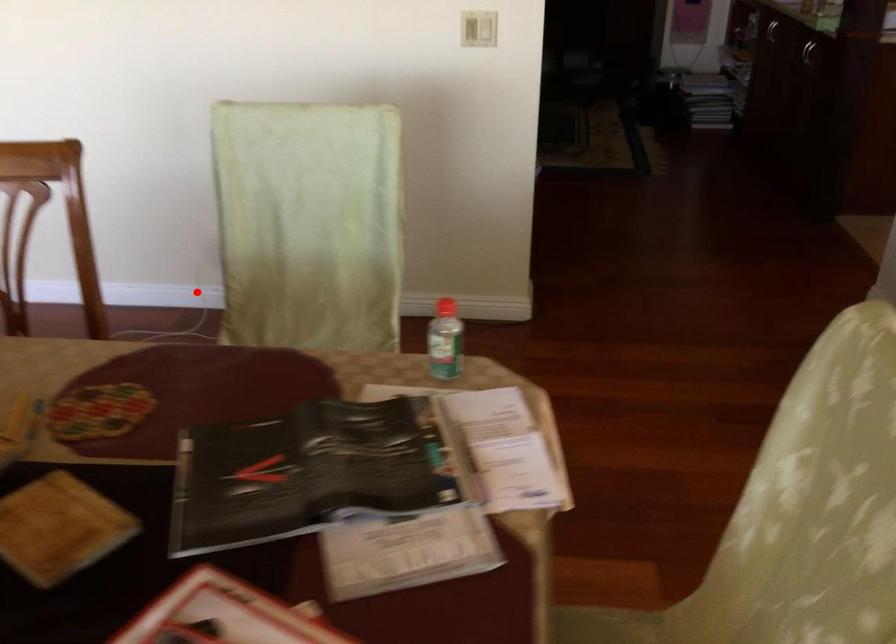
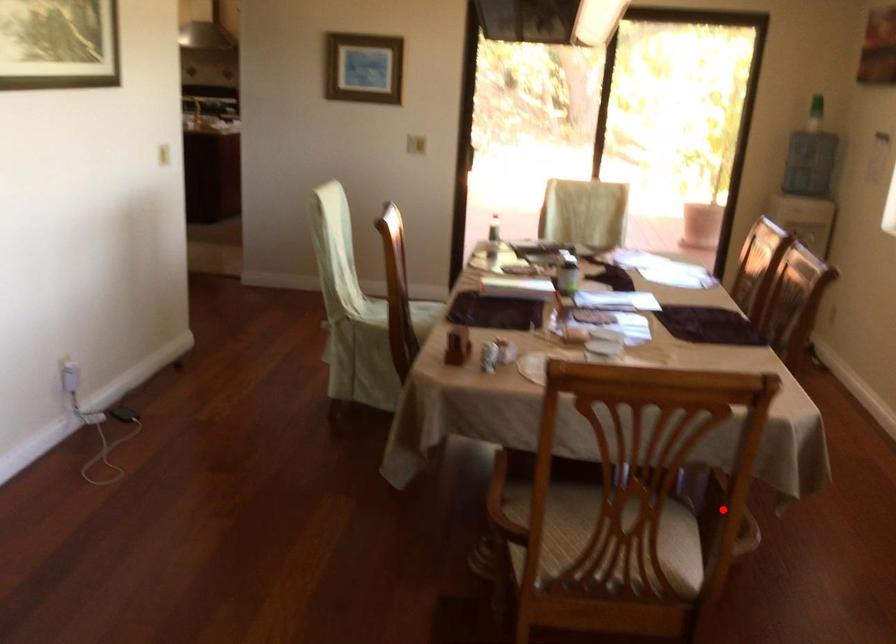
I am providing you with two images of the same scene from different viewpoints. A red point is marked on the first image and another point is marked on the second image. Do the highlighted points in image1 and image2 indicate the same real-world spot?

No